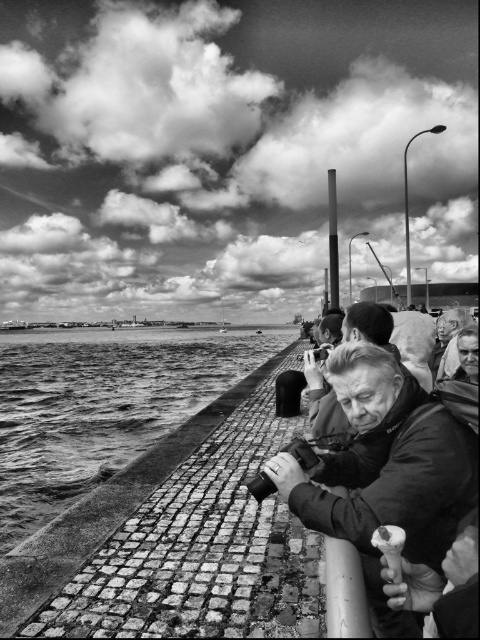
You are a photographer trying to capture a clear shot of the waterfront. You notice the matte black camera at center and the smooth leather jacket at center. Which object should you adjust to ensure the camera has a better view?

The matte black camera at center is above the smooth leather jacket at center. To ensure the camera has a better view, you should adjust the smooth leather jacket at center so it doesn

You are a photographer trying to capture the rough stone water at lower left and the matte black camera at center in your shot. Which object is positioned lower in the frame?

The rough stone water at lower left has a lesser height compared to the matte black camera at center, so the rough stone water at lower left is positioned lower in the frame.

You are standing at the point labeled as point (367, 426) in the image. You want to take a photo of the boats in the background. Since the camera is 9.28 feet away from you, will you be able to capture the boats in your photo?

The point 0.665, 0.765 is 9.28 feet from the camera. Since the boats are in the background, they are further away than the point, so you can capture them in your photo.